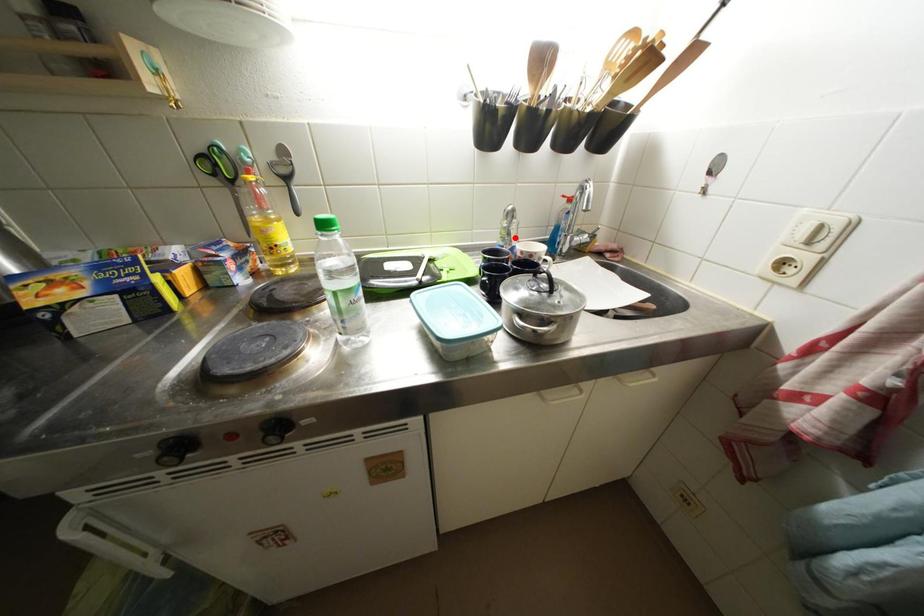
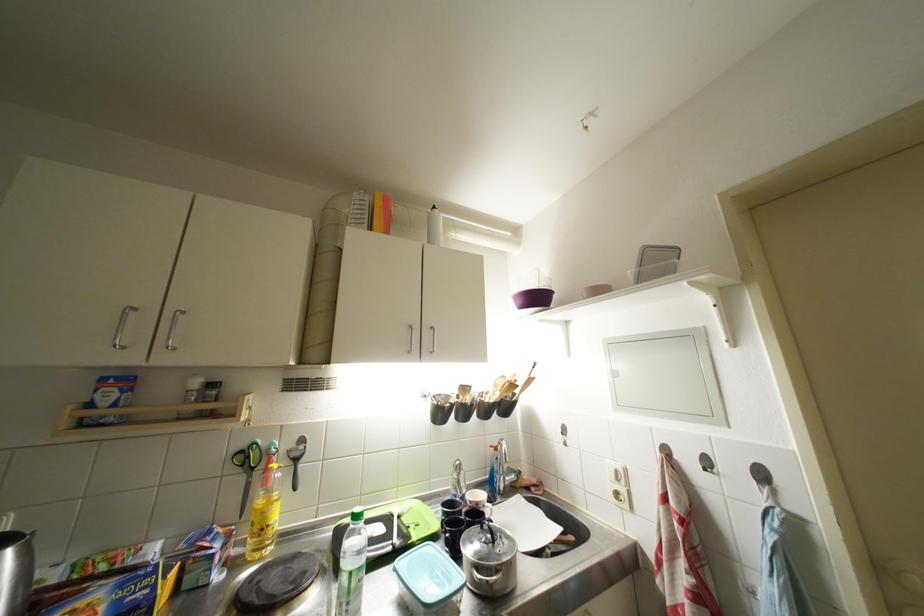
Question: A red point is marked in image1. In image2, is the corresponding 3D point closer to the camera or farther? Reply with the corresponding letter.

Choices:
 (A) The corresponding 3D point is closer.
 (B) The corresponding 3D point is farther.

Answer: (B)